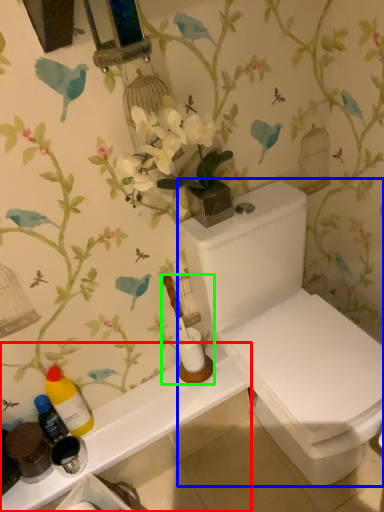
Question: Which is nearer to the counter top (highlighted by a red box)? toilet (highlighted by a blue box) or toiletries (highlighted by a green box).

Choices:
 (A) toilet
 (B) toiletries

Answer: (B)